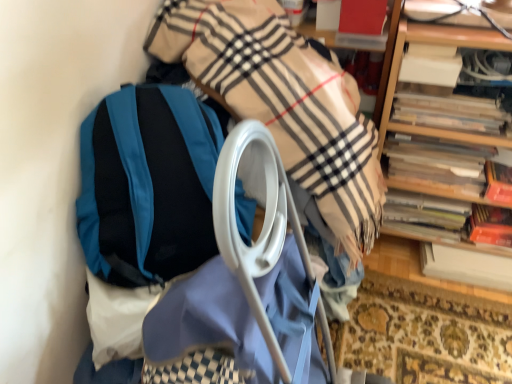
Question: From a real-world perspective, is wooden book at right, the third book in the bottom-to-top sequence, under hardcover book at right, the second book positioned from the bottom?

Choices:
 (A) yes
 (B) no

Answer: (B)

Question: Is wooden book at right, the third book in the bottom-to-top sequence, behind hardcover book at right, the second book positioned from the bottom?

Choices:
 (A) yes
 (B) no

Answer: (B)

Question: Can you confirm if wooden book at right, marked as the 3th book in a top-to-bottom arrangement, is taller than hardcover book at right, the second book positioned from the bottom?

Choices:
 (A) yes
 (B) no

Answer: (A)

Question: Is hardcover book at right, which is the 4th book from top to bottom, surrounded by wooden book at right, marked as the 3th book in a top-to-bottom arrangement?

Choices:
 (A) no
 (B) yes

Answer: (A)

Question: Is wooden book at right, marked as the 3th book in a top-to-bottom arrangement, bigger than hardcover book at right, which is the 4th book from top to bottom?

Choices:
 (A) no
 (B) yes

Answer: (A)

Question: Is wooden book at right, the third book in the bottom-to-top sequence, oriented towards hardcover book at right, the second book positioned from the bottom?

Choices:
 (A) no
 (B) yes

Answer: (A)

Question: Is wooden book at right, the third book in the bottom-to-top sequence, at the left side of teal fabric backpack at left?

Choices:
 (A) no
 (B) yes

Answer: (A)

Question: From a real-world perspective, is wooden book at right, marked as the 3th book in a top-to-bottom arrangement, located higher than teal fabric backpack at left?

Choices:
 (A) yes
 (B) no

Answer: (B)

Question: Is wooden book at right, the third book in the bottom-to-top sequence, in front of teal fabric backpack at left?

Choices:
 (A) no
 (B) yes

Answer: (A)

Question: Does wooden book at right, marked as the 3th book in a top-to-bottom arrangement, appear on the right side of teal fabric backpack at left?

Choices:
 (A) no
 (B) yes

Answer: (B)

Question: Can you confirm if wooden book at right, the third book in the bottom-to-top sequence, is smaller than teal fabric backpack at left?

Choices:
 (A) yes
 (B) no

Answer: (A)

Question: Is there a large distance between wooden book at right, the third book in the bottom-to-top sequence, and teal fabric backpack at left?

Choices:
 (A) yes
 (B) no

Answer: (B)

Question: Is wooden bookshelf at upper right completely or partially inside white paper at right, which is counted as the 1th book, starting from the bottom?

Choices:
 (A) no
 (B) yes

Answer: (A)